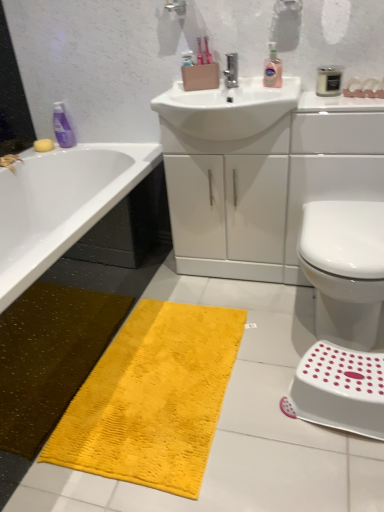
Identify the location of free location above white plastic step stool at lower right (from a real-world perspective). The height and width of the screenshot is (512, 384). (342, 369).